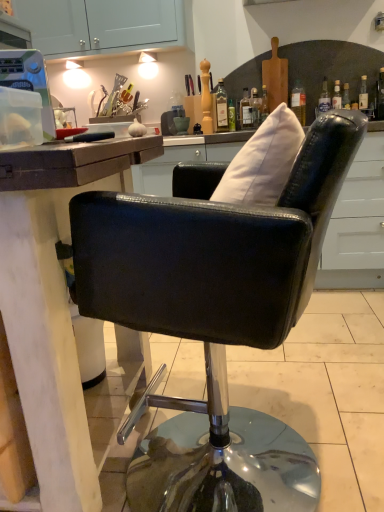
I want to click on transparent plastic container at upper left, so click(x=29, y=81).

The image size is (384, 512). Find the location of `green glass bottle at upper center, the second bottle when ordered from right to left`. green glass bottle at upper center, the second bottle when ordered from right to left is located at coordinates (231, 115).

Can you tell me how much black leather chair at center and green glass bottle at upper center, the second bottle when ordered from right to left, differ in facing direction?

They differ by 90 degrees in their facing directions.

Based on their sizes in the image, would you say black leather chair at center is bigger or smaller than green glass bottle at upper center, which ranks as the second bottle in left-to-right order?

Clearly, black leather chair at center is larger in size than green glass bottle at upper center, which ranks as the second bottle in left-to-right order.

Is black leather chair at center turned away from green glass bottle at upper center, which ranks as the second bottle in left-to-right order?

black leather chair at center is not turned away from green glass bottle at upper center, which ranks as the second bottle in left-to-right order.

Is black leather chair at center thinner than green glass bottle at upper center, the second bottle when ordered from right to left?

In fact, black leather chair at center might be wider than green glass bottle at upper center, the second bottle when ordered from right to left.

Are translucent glass bottle at upper center, positioned as the first bottle in left-to-right order, and transparent plastic container at upper left far apart?

Yes, translucent glass bottle at upper center, positioned as the first bottle in left-to-right order, is far from transparent plastic container at upper left.

Based on their sizes in the image, would you say translucent glass bottle at upper center, positioned as the first bottle in left-to-right order, is bigger or smaller than transparent plastic container at upper left?

In the image, translucent glass bottle at upper center, positioned as the first bottle in left-to-right order, appears to be smaller than transparent plastic container at upper left.

Considering the sizes of objects translucent glass bottle at upper center, the 3th bottle from the right, and transparent plastic container at upper left in the image provided, who is thinner, translucent glass bottle at upper center, the 3th bottle from the right, or transparent plastic container at upper left?

With smaller width is translucent glass bottle at upper center, the 3th bottle from the right.

From the image's perspective, is translucent glass bottle at upper center, positioned as the first bottle in left-to-right order, above transparent plastic container at upper left?

Correct, translucent glass bottle at upper center, positioned as the first bottle in left-to-right order, appears higher than transparent plastic container at upper left in the image.

Can you tell me how much translucent glass bottle at upper center, the 3th bottle from the right, and transparent glass bottle at upper right, which is the 3th bottle in left-to-right order, differ in facing direction?

45 degrees separate the facing orientations of translucent glass bottle at upper center, the 3th bottle from the right, and transparent glass bottle at upper right, which is the 3th bottle in left-to-right order.

Which of these two, translucent glass bottle at upper center, the 3th bottle from the right, or transparent glass bottle at upper right, which is the 3th bottle in left-to-right order, is bigger?

With larger size is translucent glass bottle at upper center, the 3th bottle from the right.

Is point (221, 83) positioned after point (299, 98)?

That is True.

From the image's perspective, does translucent glass bottle at upper center, positioned as the first bottle in left-to-right order, appear lower than transparent glass bottle at upper right, arranged as the 1th bottle when viewed from the right?

Correct, translucent glass bottle at upper center, positioned as the first bottle in left-to-right order, appears lower than transparent glass bottle at upper right, arranged as the 1th bottle when viewed from the right, in the image.

Considering the positions of point (233, 113) and point (263, 179), is point (233, 113) closer or farther from the camera than point (263, 179)?

Point (233, 113) is farther from the camera than point (263, 179).

Is green glass bottle at upper center, which ranks as the second bottle in left-to-right order, oriented towards white fabric pillow at upper center?

Yes, green glass bottle at upper center, which ranks as the second bottle in left-to-right order, is facing white fabric pillow at upper center.

Is green glass bottle at upper center, which ranks as the second bottle in left-to-right order, completely or partially outside of white fabric pillow at upper center?

Yes, green glass bottle at upper center, which ranks as the second bottle in left-to-right order, is located beyond the bounds of white fabric pillow at upper center.

Does green glass bottle at upper center, the second bottle when ordered from right to left, come in front of white fabric pillow at upper center?

No, the depth of green glass bottle at upper center, the second bottle when ordered from right to left, is greater than that of white fabric pillow at upper center.

Is there a large distance between transparent plastic container at upper left and black leather chair at center?

They are positioned close to each other.

Considering the sizes of transparent plastic container at upper left and black leather chair at center in the image, is transparent plastic container at upper left wider or thinner than black leather chair at center?

transparent plastic container at upper left is thinner than black leather chair at center.

Is transparent plastic container at upper left not within black leather chair at center?

transparent plastic container at upper left is positioned outside black leather chair at center.

Does green glass bottle at upper center, the second bottle when ordered from right to left, have a lesser height compared to transparent glass bottle at upper right, which is the 3th bottle in left-to-right order?

Yes, green glass bottle at upper center, the second bottle when ordered from right to left, is shorter than transparent glass bottle at upper right, which is the 3th bottle in left-to-right order.

Is green glass bottle at upper center, which ranks as the second bottle in left-to-right order, looking in the opposite direction of transparent glass bottle at upper right, which is the 3th bottle in left-to-right order?

That's not correct — green glass bottle at upper center, which ranks as the second bottle in left-to-right order, is not looking away from transparent glass bottle at upper right, which is the 3th bottle in left-to-right order.

Locate an element on the screen. Image resolution: width=384 pixels, height=512 pixels. the 2nd bottle positioned below the transparent glass bottle at upper right, arranged as the 1th bottle when viewed from the right (from the image's perspective) is located at coordinates (231, 115).

How much distance is there between green glass bottle at upper center, which ranks as the second bottle in left-to-right order, and transparent glass bottle at upper right, arranged as the 1th bottle when viewed from the right?

green glass bottle at upper center, which ranks as the second bottle in left-to-right order, and transparent glass bottle at upper right, arranged as the 1th bottle when viewed from the right, are 38.52 centimeters apart.

Does point (264, 165) come in front of point (228, 113)?

Yes, it is.

Can you tell me how much white fabric pillow at upper center and green glass bottle at upper center, the second bottle when ordered from right to left, differ in facing direction?

The angular difference between white fabric pillow at upper center and green glass bottle at upper center, the second bottle when ordered from right to left, is 90.1 degrees.

Considering the sizes of objects white fabric pillow at upper center and green glass bottle at upper center, the second bottle when ordered from right to left, in the image provided, who is bigger, white fabric pillow at upper center or green glass bottle at upper center, the second bottle when ordered from right to left,?

white fabric pillow at upper center.

Based on the photo, in terms of width, does white fabric pillow at upper center look wider or thinner when compared to green glass bottle at upper center, the second bottle when ordered from right to left?

In the image, white fabric pillow at upper center appears to be wider than green glass bottle at upper center, the second bottle when ordered from right to left.

Find the location of a particular element. bottle that is the 1st one when counting upward from the black leather chair at center (from the image's perspective) is located at coordinates (231, 115).

Find the location of `appliance located in front of the translucent glass bottle at upper center, the 3th bottle from the right`. appliance located in front of the translucent glass bottle at upper center, the 3th bottle from the right is located at coordinates (29, 81).

From the image, which object appears to be nearer to black leather chair at center, white fabric pillow at upper center or transparent glass bottle at upper right, which is the 3th bottle in left-to-right order?

white fabric pillow at upper center is positioned closer to the anchor black leather chair at center.

Which object lies nearer to the anchor point translucent glass bottle at upper center, positioned as the first bottle in left-to-right order, black leather chair at center or transparent glass bottle at upper right, which is the 3th bottle in left-to-right order?

transparent glass bottle at upper right, which is the 3th bottle in left-to-right order.

From the image, which object appears to be farther from white fabric pillow at upper center, translucent glass bottle at upper center, the 3th bottle from the right, or transparent glass bottle at upper right, which is the 3th bottle in left-to-right order?

The object further to white fabric pillow at upper center is translucent glass bottle at upper center, the 3th bottle from the right.

In the scene shown: From the image, which object appears to be nearer to transparent glass bottle at upper right, which is the 3th bottle in left-to-right order, black leather chair at center or green glass bottle at upper center, which ranks as the second bottle in left-to-right order?

Among the two, green glass bottle at upper center, which ranks as the second bottle in left-to-right order, is located nearer to transparent glass bottle at upper right, which is the 3th bottle in left-to-right order.

Which object lies further to the anchor point transparent plastic container at upper left, transparent glass bottle at upper right, which is the 3th bottle in left-to-right order, or translucent glass bottle at upper center, the 3th bottle from the right?

Among the two, transparent glass bottle at upper right, which is the 3th bottle in left-to-right order, is located further to transparent plastic container at upper left.

Looking at the image, which one is located further to transparent plastic container at upper left, translucent glass bottle at upper center, the 3th bottle from the right, or white fabric pillow at upper center?

translucent glass bottle at upper center, the 3th bottle from the right, is positioned further to the anchor transparent plastic container at upper left.

Estimate the real-world distances between objects in this image. Which object is closer to green glass bottle at upper center, the second bottle when ordered from right to left, white fabric pillow at upper center or translucent glass bottle at upper center, positioned as the first bottle in left-to-right order?

translucent glass bottle at upper center, positioned as the first bottle in left-to-right order, is closer to green glass bottle at upper center, the second bottle when ordered from right to left.

Looking at the image, which one is located closer to transparent plastic container at upper left, white fabric pillow at upper center or black leather chair at center?

Based on the image, white fabric pillow at upper center appears to be nearer to transparent plastic container at upper left.

Locate an element on the screen. appliance located between black leather chair at center and translucent glass bottle at upper center, positioned as the first bottle in left-to-right order, in the depth direction is located at coordinates (29, 81).

The width and height of the screenshot is (384, 512). Identify the location of bottle between white fabric pillow at upper center and transparent glass bottle at upper right, which is the 3th bottle in left-to-right order, from front to back. (221, 106).

At what (x,y) coordinates should I click in order to perform the action: click on chair located between transparent plastic container at upper left and white fabric pillow at upper center in the left-right direction. Please return your answer as a coordinate pair (x, y). The height and width of the screenshot is (512, 384). Looking at the image, I should click on (214, 318).

Locate an element on the screen. The width and height of the screenshot is (384, 512). appliance between white fabric pillow at upper center and transparent glass bottle at upper right, arranged as the 1th bottle when viewed from the right, along the z-axis is located at coordinates (29, 81).